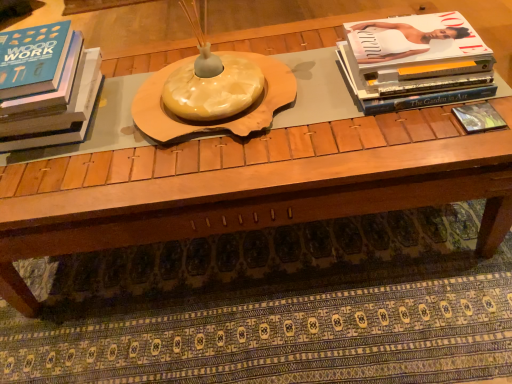
Find the location of a particular element. The height and width of the screenshot is (384, 512). vacant area that lies between matte white book at upper right, the second book positioned from the left, and matte black book at right, the first book in the right-to-left sequence is located at coordinates (429, 121).